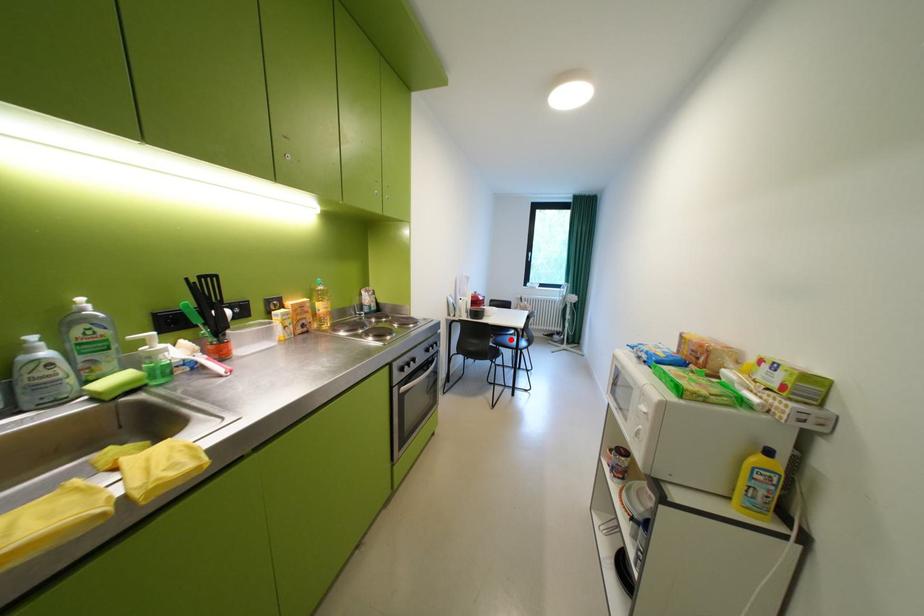
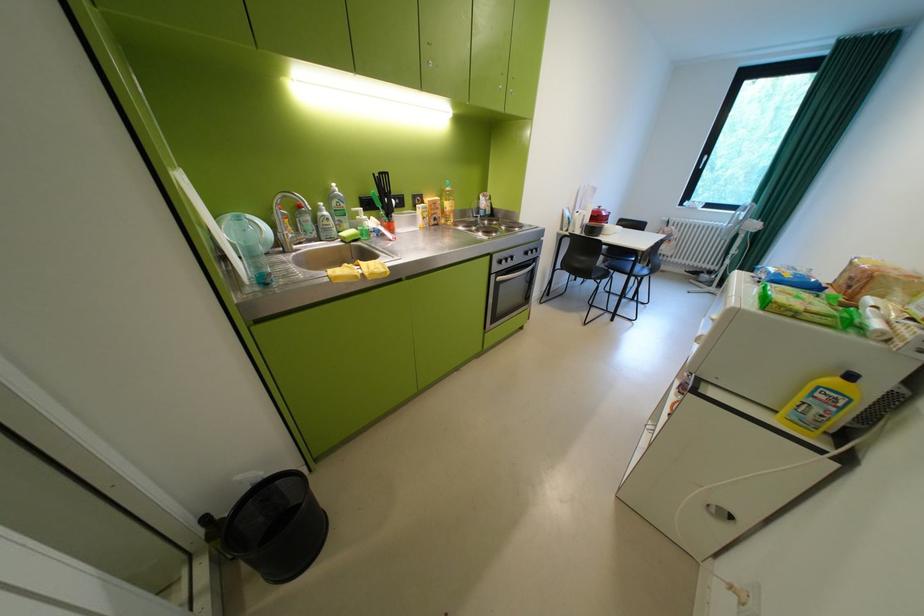
In the second image, find the point that corresponds to the highlighted location in the first image.

(626, 264)